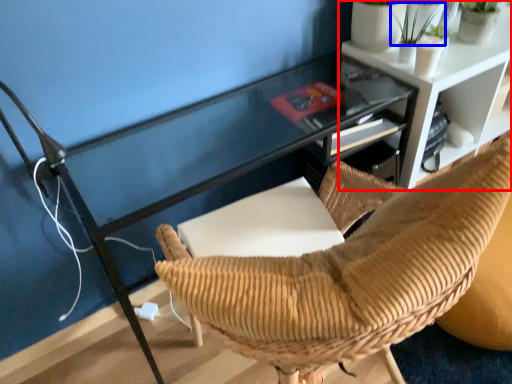
Question: Which point is closer to the camera, shelf (highlighted by a red box) or plant (highlighted by a blue box)?

Choices:
 (A) shelf
 (B) plant

Answer: (B)